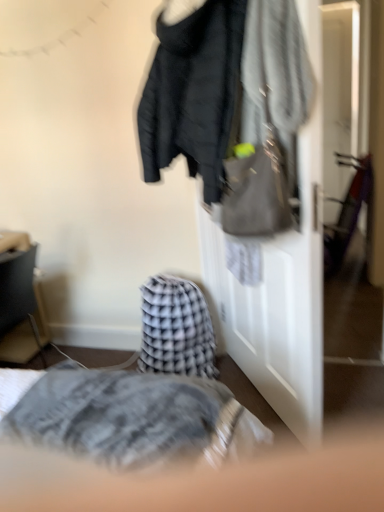
Question: Should I look upward or downward to see matte black jacket at upper center?

Choices:
 (A) down
 (B) up

Answer: (B)

Question: Is matte black side table at left facing towards matte gray handbag at upper right?

Choices:
 (A) yes
 (B) no

Answer: (A)

Question: From a real-world perspective, is matte black side table at left positioned under matte gray handbag at upper right based on gravity?

Choices:
 (A) yes
 (B) no

Answer: (A)

Question: From a real-world perspective, is matte black side table at left located higher than matte gray handbag at upper right?

Choices:
 (A) yes
 (B) no

Answer: (B)

Question: Considering the relative positions of matte black side table at left and matte gray handbag at upper right in the image provided, is matte black side table at left to the left of matte gray handbag at upper right from the viewer's perspective?

Choices:
 (A) yes
 (B) no

Answer: (A)

Question: Does matte black side table at left have a larger size compared to matte gray handbag at upper right?

Choices:
 (A) yes
 (B) no

Answer: (A)

Question: Is matte black side table at left positioned with its back to matte gray handbag at upper right?

Choices:
 (A) yes
 (B) no

Answer: (B)

Question: Is checkered fabric blanket at center outside of matte black jacket at upper center?

Choices:
 (A) no
 (B) yes

Answer: (B)

Question: Is checkered fabric blanket at center next to matte black jacket at upper center?

Choices:
 (A) no
 (B) yes

Answer: (A)

Question: Considering the relative positions of checkered fabric blanket at center and matte black jacket at upper center in the image provided, is checkered fabric blanket at center to the right of matte black jacket at upper center from the viewer's perspective?

Choices:
 (A) yes
 (B) no

Answer: (B)

Question: Is checkered fabric blanket at center aimed at matte black jacket at upper center?

Choices:
 (A) no
 (B) yes

Answer: (A)

Question: Is checkered fabric blanket at center shorter than matte black jacket at upper center?

Choices:
 (A) no
 (B) yes

Answer: (B)

Question: Does checkered fabric blanket at center come behind matte black jacket at upper center?

Choices:
 (A) yes
 (B) no

Answer: (A)

Question: Can you confirm if matte black jacket at upper center is wider than matte black jacket at center?

Choices:
 (A) no
 (B) yes

Answer: (B)